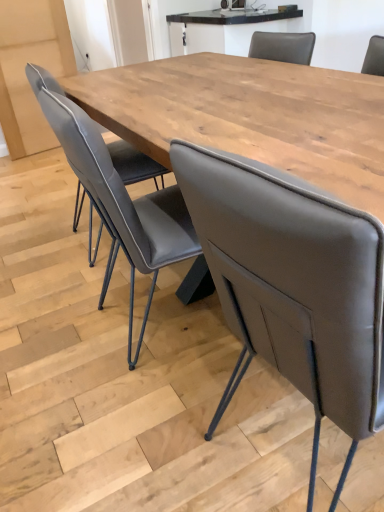
Question: Considering the relative sizes of matte gray leather chair at center, arranged as the 2th chair when viewed from the right, and light brown wood table at upper center, which is counted as the 2th table, starting from the front, in the image provided, is matte gray leather chair at center, arranged as the 2th chair when viewed from the right, shorter than light brown wood table at upper center, which is counted as the 2th table, starting from the front,?

Choices:
 (A) yes
 (B) no

Answer: (B)

Question: Can we say matte gray leather chair at center, arranged as the 2th chair when viewed from the right, lies outside light brown wood table at upper center, which is the second table from bottom to top?

Choices:
 (A) no
 (B) yes

Answer: (B)

Question: Considering the relative positions of matte gray leather chair at center, arranged as the 2th chair when viewed from the right, and light brown wood table at upper center, the 1th table viewed from the back, in the image provided, is matte gray leather chair at center, arranged as the 2th chair when viewed from the right, to the left of light brown wood table at upper center, the 1th table viewed from the back, from the viewer's perspective?

Choices:
 (A) no
 (B) yes

Answer: (B)

Question: Is matte gray leather chair at center, the 1th chair positioned from the left, positioned far away from light brown wood table at upper center, which is the second table from bottom to top?

Choices:
 (A) no
 (B) yes

Answer: (B)

Question: Can you confirm if matte gray leather chair at center, the 1th chair positioned from the left, is bigger than light brown wood table at upper center, the 1th table viewed from the back?

Choices:
 (A) no
 (B) yes

Answer: (B)

Question: From a real-world perspective, is matte gray chair at center, the 2th chair in the left-to-right sequence, positioned above or below matte gray leather chair at center, the 1th chair positioned from the left?

Choices:
 (A) above
 (B) below

Answer: (A)

Question: Is matte gray chair at center, the 2th chair in the left-to-right sequence, taller or shorter than matte gray leather chair at center, the 1th chair positioned from the left?

Choices:
 (A) short
 (B) tall

Answer: (B)

Question: Is matte gray chair at center, arranged as the first chair when viewed from the right, spatially inside matte gray leather chair at center, the 1th chair positioned from the left, or outside of it?

Choices:
 (A) outside
 (B) inside

Answer: (A)

Question: From the image's perspective, is matte gray chair at center, the 2th chair in the left-to-right sequence, above or below matte gray leather chair at center, the 1th chair positioned from the left?

Choices:
 (A) below
 (B) above

Answer: (A)

Question: Considering the relative positions of matte gray leather chair at center, the 1th chair positioned from the left, and matte gray chair at center, arranged as the first chair when viewed from the right, in the image provided, is matte gray leather chair at center, the 1th chair positioned from the left, to the left or to the right of matte gray chair at center, arranged as the first chair when viewed from the right,?

Choices:
 (A) left
 (B) right

Answer: (A)

Question: Considering the positions of matte gray leather chair at center, the 1th chair positioned from the left, and matte gray chair at center, the 2th chair in the left-to-right sequence, in the image, is matte gray leather chair at center, the 1th chair positioned from the left, wider or thinner than matte gray chair at center, the 2th chair in the left-to-right sequence,?

Choices:
 (A) wide
 (B) thin

Answer: (B)

Question: Does point (165, 188) appear closer or farther from the camera than point (299, 221)?

Choices:
 (A) farther
 (B) closer

Answer: (A)

Question: Would you say matte gray leather chair at center, arranged as the 2th chair when viewed from the right, is inside or outside matte gray chair at center, arranged as the first chair when viewed from the right?

Choices:
 (A) inside
 (B) outside

Answer: (B)

Question: Is wooden table at center, which is counted as the second table, starting from the back, taller or shorter than matte gray chair at center, arranged as the first chair when viewed from the right?

Choices:
 (A) tall
 (B) short

Answer: (B)

Question: Is point (238, 143) positioned closer to the camera than point (258, 325)?

Choices:
 (A) closer
 (B) farther

Answer: (B)